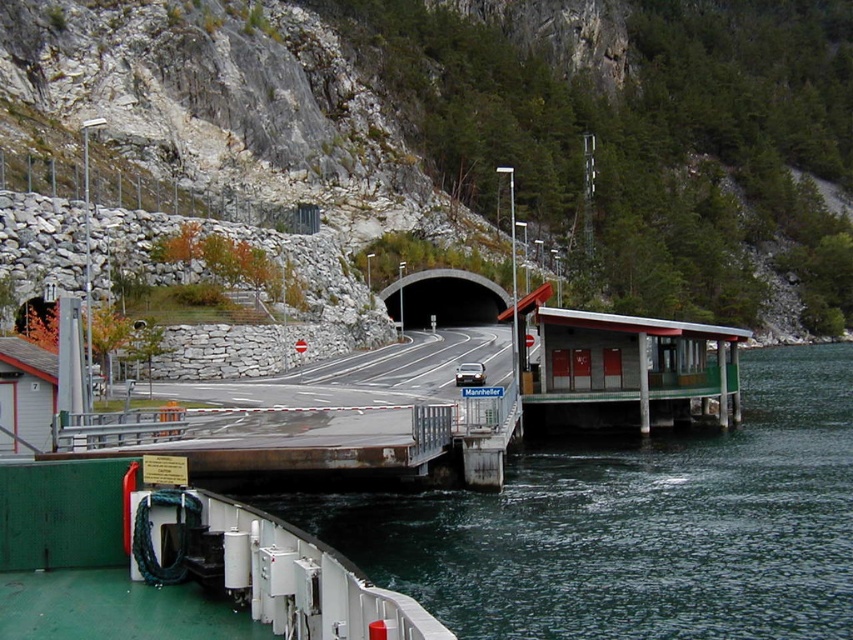
Can you confirm if dark blue water at lower center is bigger than black concrete tunnel at center?

Yes, dark blue water at lower center is bigger than black concrete tunnel at center.

Is point (625, 440) positioned in front of point (450, 308)?

That is True.

Does point (482, 572) come farther from viewer compared to point (390, 289)?

No, (482, 572) is closer to viewer.

This screenshot has width=853, height=640. Identify the location of dark blue water at lower center. (635, 524).